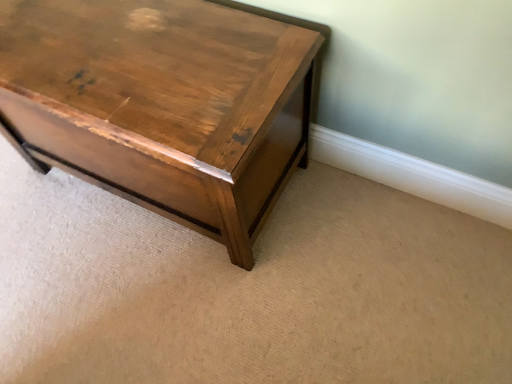
What do you see at coordinates (163, 105) in the screenshot? The height and width of the screenshot is (384, 512). I see `shiny brown wood table at center` at bounding box center [163, 105].

I want to click on shiny brown wood table at center, so click(163, 105).

Locate an element on the screen. shiny brown wood table at center is located at coordinates (163, 105).